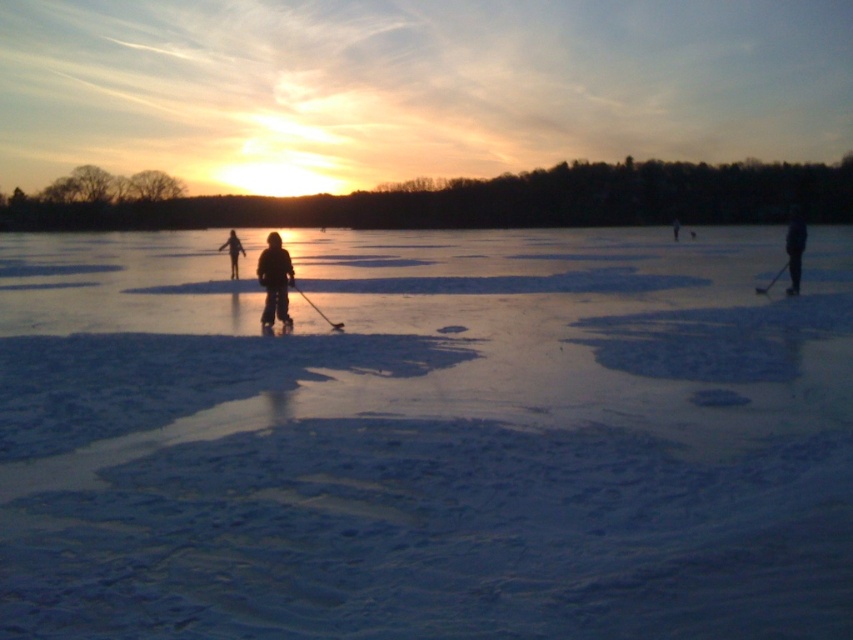
Question: Which point is farther from the camera taking this photo?

Choices:
 (A) (766, 284)
 (B) (799, 218)
 (C) (676, 230)
 (D) (334, 324)

Answer: (C)

Question: Estimate the real-world distances between objects in this image. Which object is farther from the black matte snowsuit at center?

Choices:
 (A) dark blue snowsuit at right
 (B) dark blue jacket at right

Answer: (A)

Question: Can you confirm if white matte ice at center is positioned to the right of dark blue jacket at right?

Choices:
 (A) no
 (B) yes

Answer: (A)

Question: Which point is farther to the camera?

Choices:
 (A) (793, 220)
 (B) (335, 323)
 (C) (770, 285)
 (D) (260, 269)

Answer: (C)

Question: Is white matte ice at center closer to camera compared to dark blue jacket at right?

Choices:
 (A) yes
 (B) no

Answer: (A)

Question: Is the position of white matte ice at center more distant than that of dark blue snowsuit at right?

Choices:
 (A) yes
 (B) no

Answer: (B)